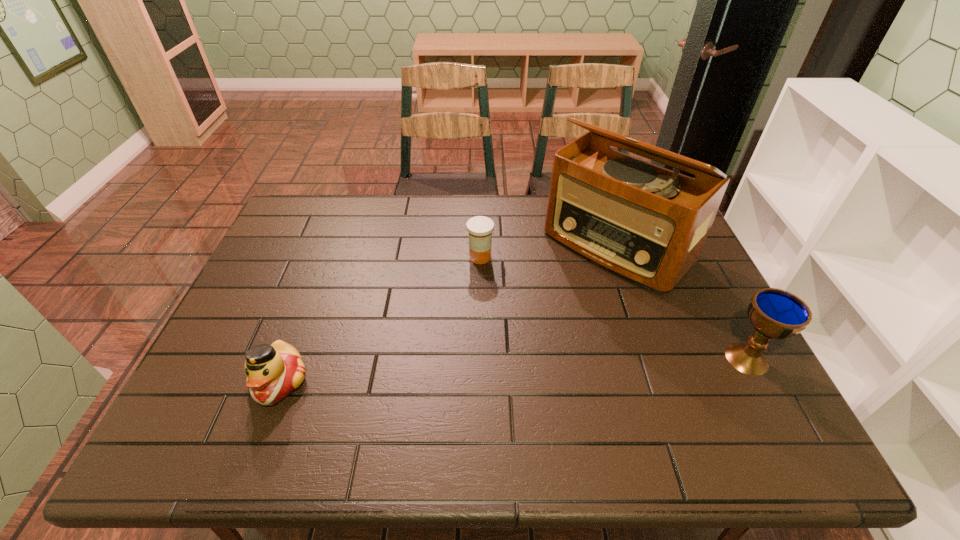
Where is `vacant space on the desktop that is between the duck and the second tallest object and is positioned on the label of the medicine`? This screenshot has width=960, height=540. vacant space on the desktop that is between the duck and the second tallest object and is positioned on the label of the medicine is located at coordinates (505, 370).

What are the coordinates of `free space on the desktop that is between the leftmost object and the second tallest object and is positioned on the front panel of the tallest object` in the screenshot? It's located at (481, 372).